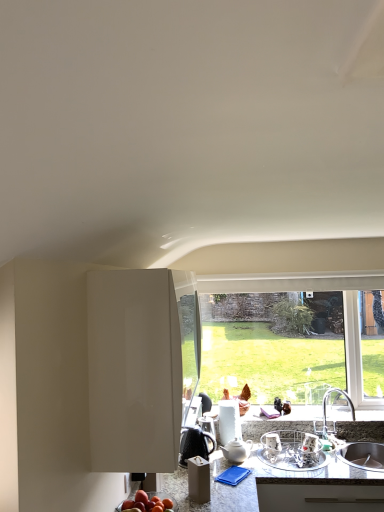
Question: From the image's perspective, is white glossy cabinet at center over granite gray countertop at lower center?

Choices:
 (A) yes
 (B) no

Answer: (A)

Question: From a real-world perspective, is white glossy cabinet at center positioned over granite gray countertop at lower center based on gravity?

Choices:
 (A) no
 (B) yes

Answer: (B)

Question: Does white glossy cabinet at center appear on the right side of granite gray countertop at lower center?

Choices:
 (A) no
 (B) yes

Answer: (A)

Question: Considering the relative sizes of white glossy cabinet at center and granite gray countertop at lower center in the image provided, is white glossy cabinet at center shorter than granite gray countertop at lower center?

Choices:
 (A) yes
 (B) no

Answer: (B)

Question: Is white glossy cabinet at center looking in the opposite direction of granite gray countertop at lower center?

Choices:
 (A) yes
 (B) no

Answer: (B)

Question: Considering the positions of transparent glass window at center and white glossy cabinet at center in the image, is transparent glass window at center taller or shorter than white glossy cabinet at center?

Choices:
 (A) tall
 (B) short

Answer: (A)

Question: From the image's perspective, relative to white glossy cabinet at center, is transparent glass window at center above or below?

Choices:
 (A) above
 (B) below

Answer: (B)

Question: Is point (316, 366) positioned closer to the camera than point (125, 456)?

Choices:
 (A) closer
 (B) farther

Answer: (B)

Question: In the image, is transparent glass window at center on the left side or the right side of white glossy cabinet at center?

Choices:
 (A) left
 (B) right

Answer: (B)

Question: In the image, is shiny red apple at lower center on the left side or the right side of black glossy coffee pot at center, which ranks as the 1th appliance in left-to-right order?

Choices:
 (A) left
 (B) right

Answer: (A)

Question: From the image's perspective, is shiny red apple at lower center positioned above or below black glossy coffee pot at center, acting as the second appliance starting from the right?

Choices:
 (A) above
 (B) below

Answer: (A)

Question: Is shiny red apple at lower center in front of or behind black glossy coffee pot at center, acting as the second appliance starting from the right, in the image?

Choices:
 (A) front
 (B) behind

Answer: (A)

Question: Is point pyautogui.click(x=157, y=500) closer or farther from the camera than point pyautogui.click(x=210, y=449)?

Choices:
 (A) farther
 (B) closer

Answer: (B)

Question: Considering the positions of metallic silver dish rack at center, arranged as the 2th appliance when viewed from the left, and white glossy cabinet at center in the image, is metallic silver dish rack at center, arranged as the 2th appliance when viewed from the left, bigger or smaller than white glossy cabinet at center?

Choices:
 (A) big
 (B) small

Answer: (B)

Question: From a real-world perspective, relative to white glossy cabinet at center, is metallic silver dish rack at center, the 1th appliance viewed from the right, vertically above or below?

Choices:
 (A) above
 (B) below

Answer: (B)